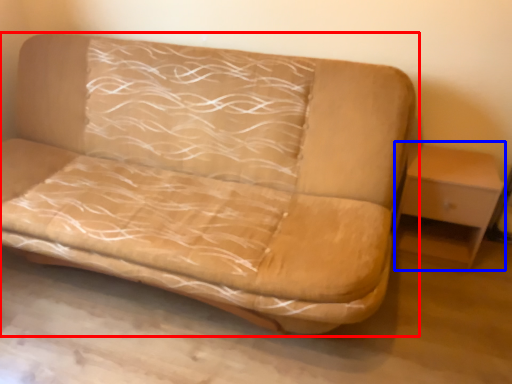
Question: Which of the following is the closest to the observer, studio couch (highlighted by a red box) or table (highlighted by a blue box)?

Choices:
 (A) studio couch
 (B) table

Answer: (A)